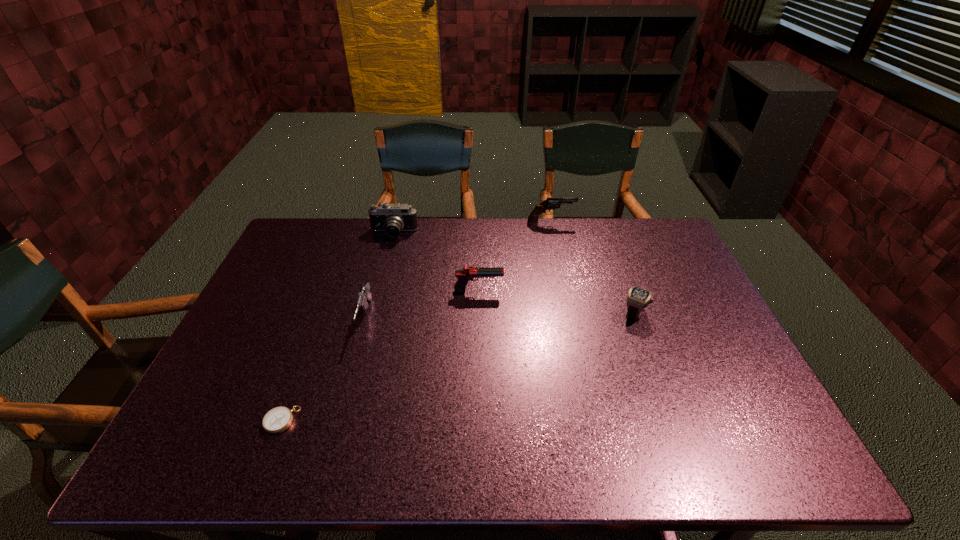
The height and width of the screenshot is (540, 960). I want to click on vacant point that satisfies the following two spatial constraints: 1. on the back side of the rightmost object; 2. on the right side of the nearest object, so click(322, 313).

Locate an element on the screen. This screenshot has height=540, width=960. vacant area in the image that satisfies the following two spatial constraints: 1. at the aiming end of the fourth nearest object; 2. at the barrel of the leftmost gun is located at coordinates (479, 318).